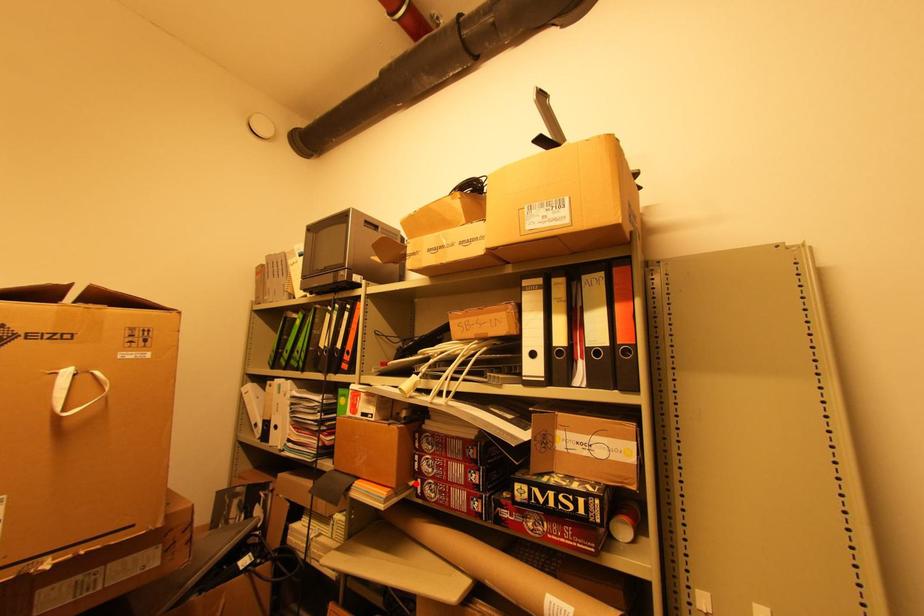
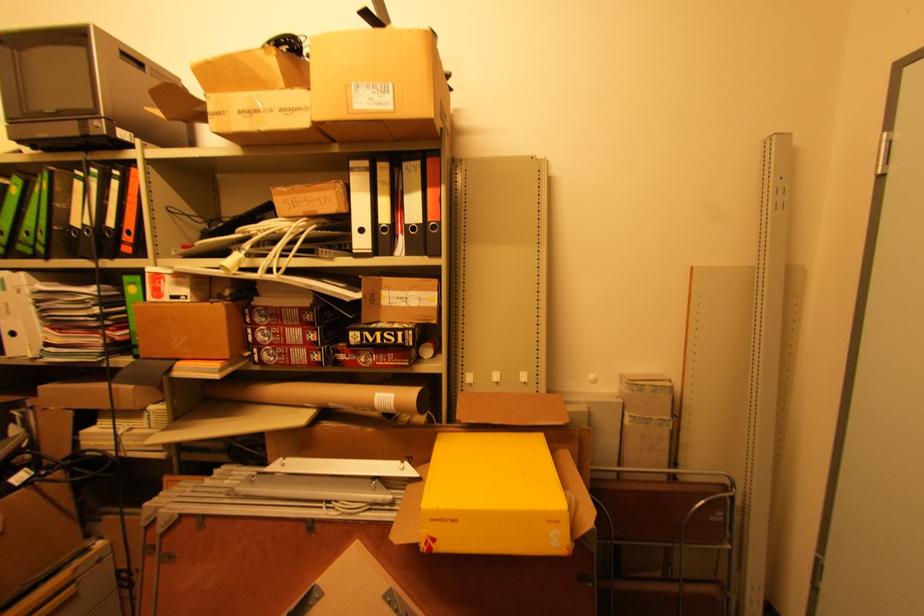
The point at the highlighted location is marked in the first image. Where is the corresponding point in the second image?

(251, 354)